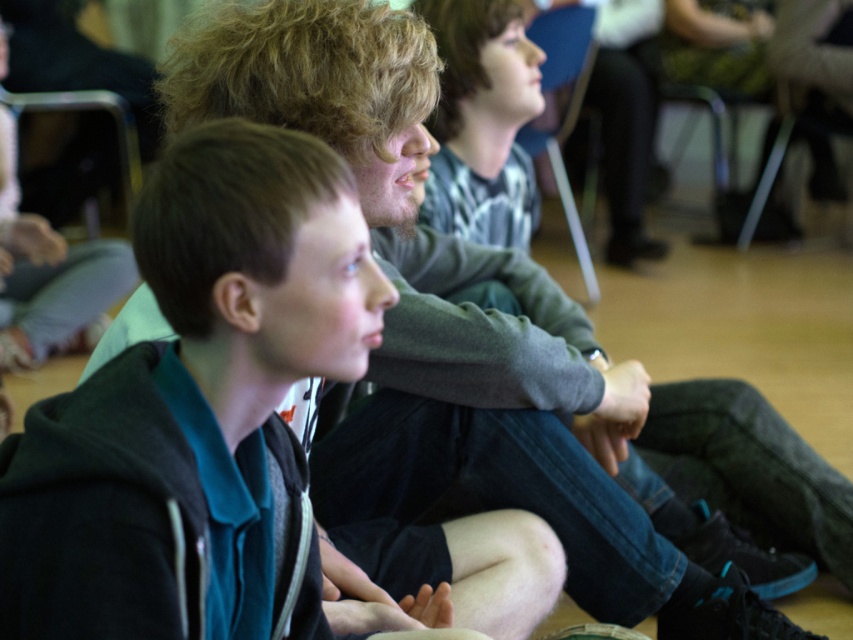
You are a photographer setting up for an event. You need to decide whether the black matte hoodie at left will fit under the blue fabric chair at upper center. Can it fit vertically?

The black matte hoodie at left is not as tall as the blue fabric chair at upper center, so it should fit vertically under the chair.